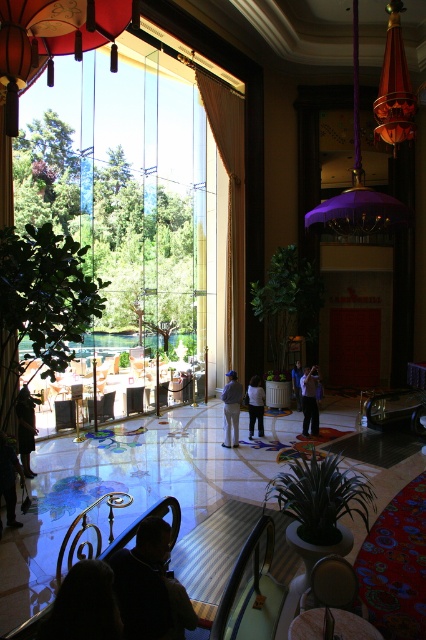
Which is above, dark brown leather jacket at lower left or light blue shirt at center?

Positioned higher is light blue shirt at center.

The width and height of the screenshot is (426, 640). What do you see at coordinates (8, 477) in the screenshot?
I see `dark brown leather jacket at lower left` at bounding box center [8, 477].

Does point (11, 518) lie behind point (308, 419)?

No, (11, 518) is in front of (308, 419).

Image resolution: width=426 pixels, height=640 pixels. I want to click on dark brown leather jacket at lower left, so click(x=8, y=477).

Which is above, dark fabric at lower center or dark blue jeans at lower left?

dark fabric at lower center is above.

Is dark fabric at lower center above dark blue jeans at lower left?

Correct, dark fabric at lower center is located above dark blue jeans at lower left.

Does point (118, 611) come closer to viewer compared to point (32, 435)?

That is True.

Identify the location of dark fabric at lower center. (83, 605).

Is point (135, 624) closer to camera compared to point (296, 371)?

Yes.

Is point (127, 561) farther from camera compared to point (293, 388)?

No.

Does point (143, 614) come farther from viewer compared to point (296, 401)?

That is False.

At what (x,y) coordinates should I click in order to perform the action: click on dark fabric jacket at lower center. Please return your answer as a coordinate pair (x, y). The height and width of the screenshot is (640, 426). Looking at the image, I should click on (146, 582).